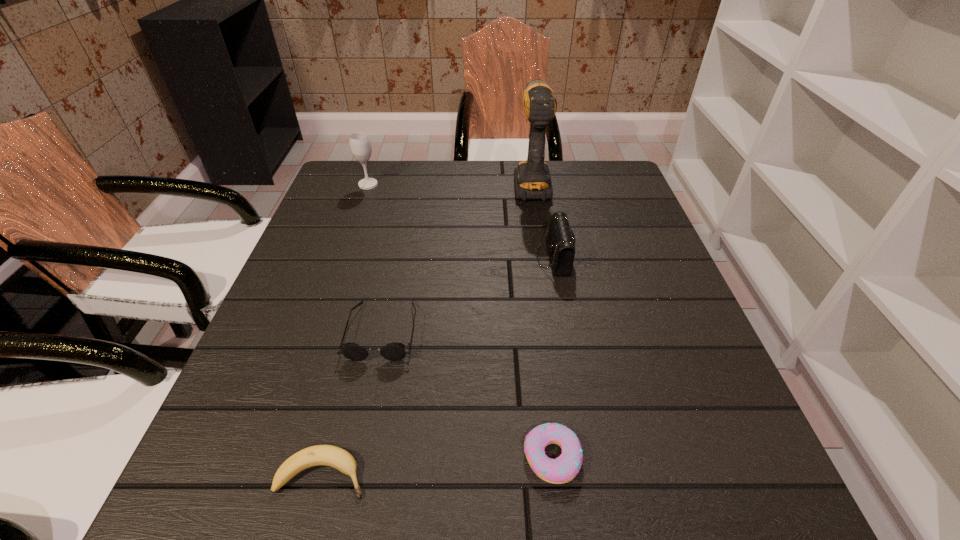
The image size is (960, 540). Find the location of `free space that is in between the wineglass and the drill`. free space that is in between the wineglass and the drill is located at coordinates (449, 184).

This screenshot has height=540, width=960. Find the location of `vacant area between the doughnut and the fourth nearest object`. vacant area between the doughnut and the fourth nearest object is located at coordinates point(553,357).

Find the location of `unoccupied area between the doughnut and the drill`. unoccupied area between the doughnut and the drill is located at coordinates (541, 320).

Identify the location of free space that is in between the drill and the third shortest object. (457, 256).

This screenshot has height=540, width=960. Identify the location of vacant point located between the drill and the second tallest object. (449, 184).

What are the coordinates of `blank region between the wineglass and the doughnut` in the screenshot? It's located at (460, 321).

Locate an element on the screen. The height and width of the screenshot is (540, 960). unoccupied position between the tallest object and the fourth farthest object is located at coordinates (457, 256).

The height and width of the screenshot is (540, 960). In order to click on free space that is in between the second tallest object and the drill in this screenshot , I will do `click(449, 184)`.

This screenshot has height=540, width=960. What are the coordinates of `vacant space that is in between the banana and the doughnut` in the screenshot? It's located at (438, 465).

Identify which object is the fourth nearest to the doughnut. Please provide its 2D coordinates. Your answer should be formatted as a tuple, i.e. [(x, y)], where the tuple contains the x and y coordinates of a point satisfying the conditions above.

[(532, 179)]